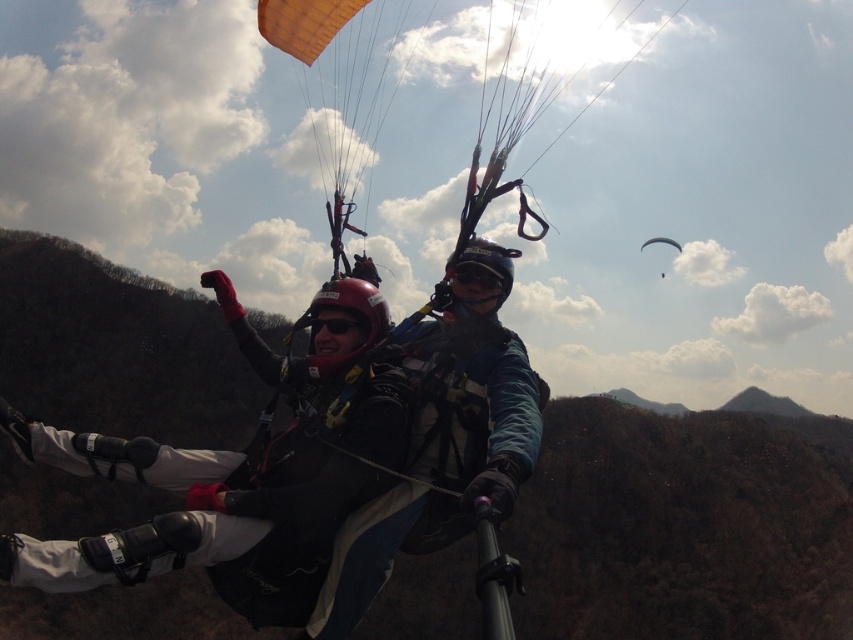
Based on the scene, which object is significantly larger in size between the brown textured mountain at center and the matte black helmet at center?

The brown textured mountain at center is much taller than the matte black helmet at center, making it significantly larger in size.

You are a drone operator trying to capture a photo of the brown textured mountain at center and the matte black helmet at center. The minimum distance required for your drone to focus on both objects clearly is 400 feet. Can your drone capture both objects in focus at the same time?

The brown textured mountain at center and matte black helmet at center are 407.78 feet apart from each other. Since the distance between them is greater than the minimum required 400 feet, the drone may struggle to keep both objects in focus simultaneously. Adjust the focus or move closer to ensure clarity.

You are a photographer trying to capture a photo of the brown textured mountain at center and the white matte parachute at upper center. Which object should you focus on first if you want to ensure both are in clear focus?

You should focus on the brown textured mountain at center first because it is closer to the viewer than the white matte parachute at upper center. By focusing on the closer object, the parachute will also be in focus due to the depth of field.